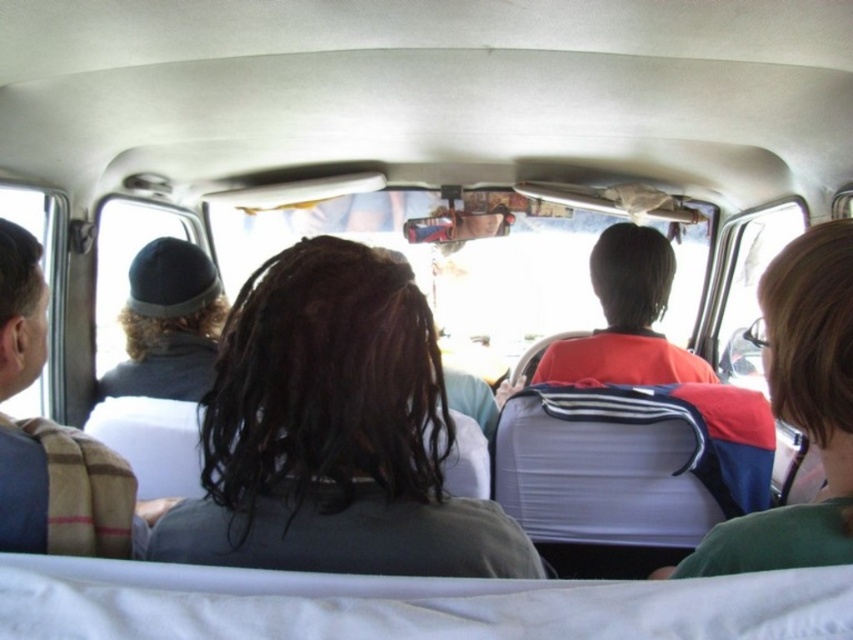
You are a passenger in a van and need to locate the person with dark brown hair at center. According to the coordinates given, where would you look in the van?

The dark brown hair at center is located at the 2D coordinates point (334, 433), which means it is positioned approximately two thirds of the way from the left edge and slightly below the center vertically in the van.

You are a passenger in the back of the vehicle and want to reach the red and blue backpack at center and the red matte shirt at center. Which item is closer to your left side?

The red and blue backpack at center is to the left of red matte shirt at center, so the backpack is closer to your left side.

You are a passenger in the vehicle and need to place a 15 cm wide item between the red and blue backpack at center and the red matte shirt at center. Is there enough space?

The red and blue backpack at center has a lesser width compared to red matte shirt at center. Therefore, there is enough space between them to place a 15 cm wide item.